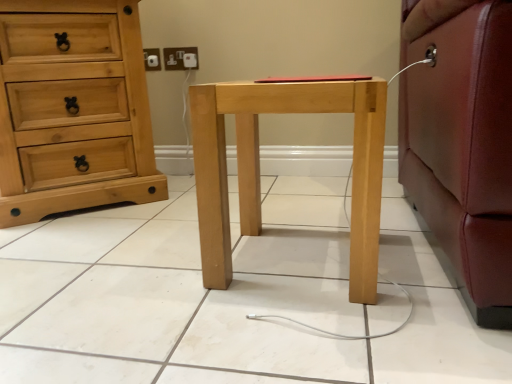
Question: Considering the relative positions of white plastic electric outlet at upper center and natural wood chest of drawers at left in the image provided, is white plastic electric outlet at upper center in front of natural wood chest of drawers at left?

Choices:
 (A) yes
 (B) no

Answer: (B)

Question: Could you tell me if white plastic electric outlet at upper center is facing natural wood chest of drawers at left?

Choices:
 (A) yes
 (B) no

Answer: (A)

Question: Is white plastic electric outlet at upper center positioned with its back to natural wood chest of drawers at left?

Choices:
 (A) yes
 (B) no

Answer: (B)

Question: Is white plastic electric outlet at upper center thinner than natural wood chest of drawers at left?

Choices:
 (A) no
 (B) yes

Answer: (B)

Question: Is white plastic electric outlet at upper center taller than natural wood chest of drawers at left?

Choices:
 (A) no
 (B) yes

Answer: (A)

Question: Is white plastic electric outlet at upper center positioned far away from natural wood chest of drawers at left?

Choices:
 (A) no
 (B) yes

Answer: (A)

Question: Is the depth of natural wood chest of drawers at left greater than that of white plastic electric outlet at upper center?

Choices:
 (A) yes
 (B) no

Answer: (B)

Question: Is natural wood chest of drawers at left positioned with its back to white plastic electric outlet at upper center?

Choices:
 (A) yes
 (B) no

Answer: (B)

Question: From a real-world perspective, is natural wood chest of drawers at left physically above white plastic electric outlet at upper center?

Choices:
 (A) no
 (B) yes

Answer: (A)

Question: Can you confirm if natural wood chest of drawers at left is wider than white plastic electric outlet at upper center?

Choices:
 (A) no
 (B) yes

Answer: (B)

Question: From the image's perspective, is natural wood chest of drawers at left above white plastic electric outlet at upper center?

Choices:
 (A) yes
 (B) no

Answer: (B)

Question: Is natural wood chest of drawers at left oriented towards white plastic electric outlet at upper center?

Choices:
 (A) yes
 (B) no

Answer: (B)

Question: Is the position of natural wood nightstand at center more distant than that of natural wood chest of drawers at left?

Choices:
 (A) yes
 (B) no

Answer: (B)